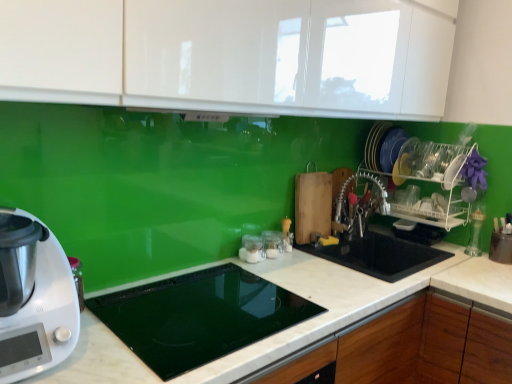
Question: Should I look upward or downward to see satin nickel faucet at center right?

Choices:
 (A) down
 (B) up

Answer: (A)

Question: Is clear glass jars at center, which is the 1th appliance from back to front, to the left of white glossy cabinet at upper center from the viewer's perspective?

Choices:
 (A) yes
 (B) no

Answer: (A)

Question: Can you confirm if clear glass jars at center, which is the 1th appliance from back to front, is taller than white glossy cabinet at upper center?

Choices:
 (A) no
 (B) yes

Answer: (A)

Question: From a real-world perspective, is clear glass jars at center, which is the 1th appliance from back to front, located beneath white glossy cabinet at upper center?

Choices:
 (A) no
 (B) yes

Answer: (B)

Question: Is clear glass jars at center, which is the 1th appliance from back to front, oriented towards white glossy cabinet at upper center?

Choices:
 (A) no
 (B) yes

Answer: (A)

Question: Is clear glass jars at center, which is the third appliance from front to back, placed right next to white glossy cabinet at upper center?

Choices:
 (A) yes
 (B) no

Answer: (B)

Question: From the image's perspective, does clear glass jars at center, which is the 1th appliance from back to front, appear higher than white glossy cabinet at upper center?

Choices:
 (A) no
 (B) yes

Answer: (A)

Question: Is the depth of black glass cooktop at center, which appears as the 1th appliance when viewed from the front, less than that of clear glass jars at center, which is the third appliance from front to back?

Choices:
 (A) no
 (B) yes

Answer: (B)

Question: From the image's perspective, is black glass cooktop at center, which appears as the 1th appliance when viewed from the front, located above clear glass jars at center, which is the third appliance from front to back?

Choices:
 (A) no
 (B) yes

Answer: (A)

Question: Is clear glass jars at center, which is the third appliance from front to back, located within black glass cooktop at center, which appears as the 3th appliance when viewed from the back?

Choices:
 (A) no
 (B) yes

Answer: (A)

Question: Can you confirm if black glass cooktop at center, which appears as the 3th appliance when viewed from the back, is smaller than clear glass jars at center, which is the third appliance from front to back?

Choices:
 (A) no
 (B) yes

Answer: (A)

Question: Is black glass cooktop at center, which appears as the 1th appliance when viewed from the front, completely or partially outside of clear glass jars at center, which is the 1th appliance from back to front?

Choices:
 (A) yes
 (B) no

Answer: (A)

Question: Is black glass cooktop at center, which appears as the 3th appliance when viewed from the back, at the left side of clear glass jars at center, which is the 1th appliance from back to front?

Choices:
 (A) yes
 (B) no

Answer: (A)

Question: Can you confirm if clear glass jar at center, the 2th appliance in the front-to-back sequence, is thinner than white glossy cabinet at upper center?

Choices:
 (A) no
 (B) yes

Answer: (B)